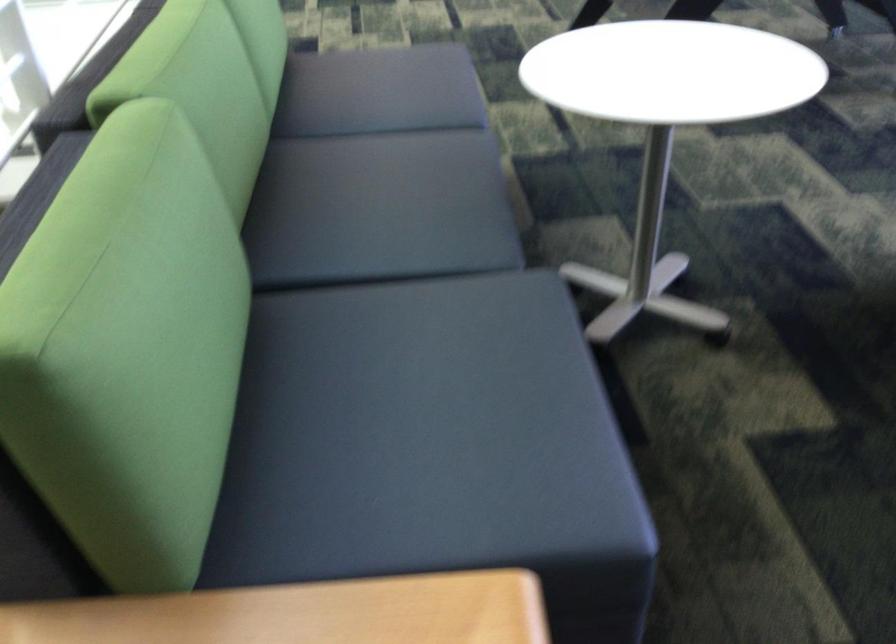
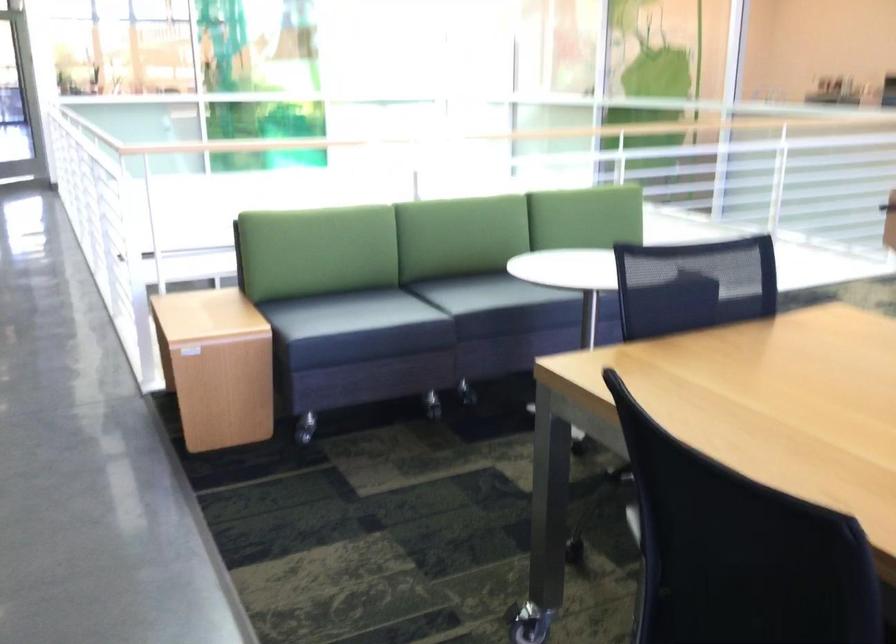
Question: I am providing you with two images of the same scene from different viewpoints. Which of the following objects are not visible in image2?

Choices:
 (A) railing handrail
 (B) gray recliner sitting surface
 (C) dark sofa sitting surface
 (D) sofa caster wheel

Answer: (C)